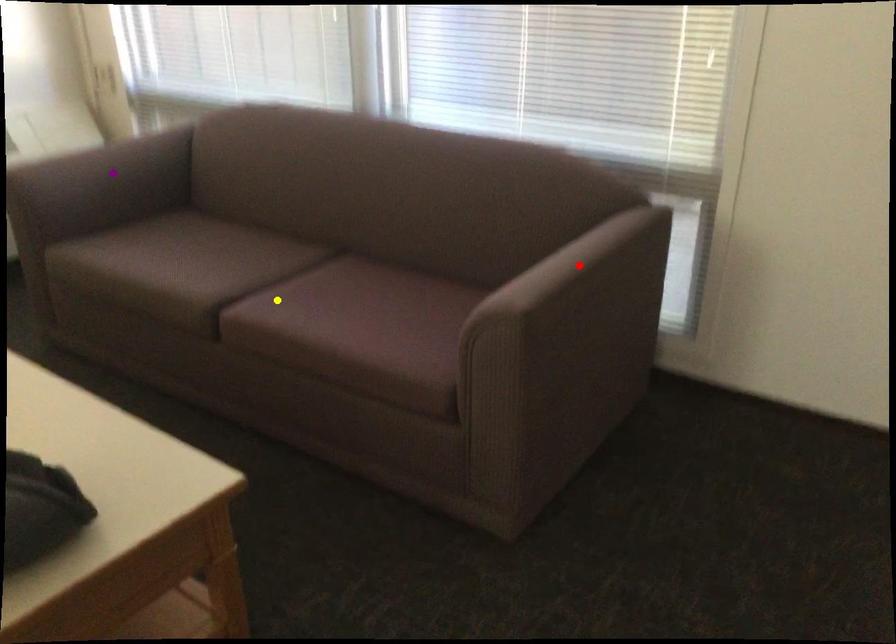
Order these from nearest to farthest:
- purple point
- red point
- yellow point

red point < yellow point < purple point